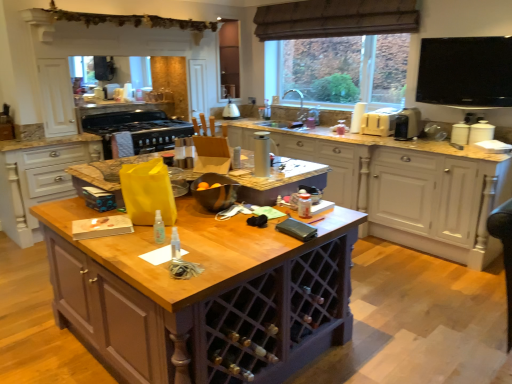
Locate an element on the screen. This screenshot has width=512, height=384. brown textured curtain at upper center is located at coordinates point(335,19).

This screenshot has width=512, height=384. In order to click on wooden island at center, the second cabinetry in the right-to-left sequence in this screenshot , I will do `click(204, 296)`.

Where is `metallic silver bowl at center, the seventh appliance from the back`? The height and width of the screenshot is (384, 512). metallic silver bowl at center, the seventh appliance from the back is located at coordinates (215, 191).

The width and height of the screenshot is (512, 384). I want to click on brown textured curtain at upper center, so click(x=335, y=19).

Considering the relative sizes of metallic silver bowl at center, the 3th appliance from the left, and metallic silver toaster at right in the image provided, is metallic silver bowl at center, the 3th appliance from the left, thinner than metallic silver toaster at right?

Yes.

Is metallic silver bowl at center, which is counted as the first appliance, starting from the front, smaller than metallic silver toaster at right?

Actually, metallic silver bowl at center, which is counted as the first appliance, starting from the front, might be larger than metallic silver toaster at right.

Is point (208, 175) less distant than point (408, 116)?

Yes, it is in front of point (408, 116).

In terms of height, does metallic silver bowl at center, which is counted as the first appliance, starting from the front, look taller or shorter compared to metallic silver toaster at right?

Clearly, metallic silver bowl at center, which is counted as the first appliance, starting from the front, is shorter compared to metallic silver toaster at right.

From the image's perspective, who appears lower, metallic silver bowl at center, the 3th appliance from the left, or transparent plastic spray bottle at center?

transparent plastic spray bottle at center appears lower in the image.

Is metallic silver bowl at center, which is counted as the first appliance, starting from the front, completely or partially outside of transparent plastic spray bottle at center?

Yes, metallic silver bowl at center, which is counted as the first appliance, starting from the front, is outside of transparent plastic spray bottle at center.

Considering the sizes of objects metallic silver bowl at center, which is the 5th appliance in right-to-left order, and transparent plastic spray bottle at center in the image provided, who is bigger, metallic silver bowl at center, which is the 5th appliance in right-to-left order, or transparent plastic spray bottle at center?

Bigger between the two is metallic silver bowl at center, which is the 5th appliance in right-to-left order.

Locate an element on the screen. the 2nd appliance to the right of the transparent plastic spray bottle at center, starting your count from the anchor is located at coordinates (215, 191).

Would you say white matte canister at right, the 3th appliance positioned from the front, is to the left or to the right of metallic silver kettle at center, which is the 6th appliance from right to left, in the picture?

white matte canister at right, the 3th appliance positioned from the front, is to the right of metallic silver kettle at center, which is the 6th appliance from right to left.

Is point (490, 137) more distant than point (225, 112)?

No, it is not.

Can you confirm if white matte canister at right, which is counted as the seventh appliance, starting from the left, is thinner than metallic silver kettle at center, which is the 6th appliance from right to left?

Yes.

From the image's perspective, which one is positioned lower, white matte canister at right, the 3th appliance positioned from the front, or metallic silver kettle at center, which is the 6th appliance from right to left?

From the image's view, white matte canister at right, the 3th appliance positioned from the front, is below.

Is point (213, 176) behind point (260, 143)?

No.

Is metallic silver bowl at center, the seventh appliance from the back, surrounding silver metallic thermos at center, arranged as the 2th appliance when viewed from the front?

No, silver metallic thermos at center, arranged as the 2th appliance when viewed from the front, is not surrounded by metallic silver bowl at center, the seventh appliance from the back.

From a real-world perspective, between metallic silver bowl at center, the 3th appliance from the left, and silver metallic thermos at center, arranged as the 2th appliance when viewed from the front, who is vertically higher?

silver metallic thermos at center, arranged as the 2th appliance when viewed from the front, is physically above.

From the picture: Is silver metallic thermos at center, which ranks as the fourth appliance in left-to-right order, at the back of metallic silver bowl at center, the seventh appliance from the back?

No, metallic silver bowl at center, the seventh appliance from the back, is not facing away from silver metallic thermos at center, which ranks as the fourth appliance in left-to-right order.

From the image's perspective, which appliance is the 1st one above the wooden cabinet at center, the third cabinetry from the right? Please provide its 2D coordinates.

[(262, 154)]

Is wooden cabinet at center, which ranks as the first cabinetry in left-to-right order, surrounding silver metallic thermos at center, the fourth appliance when ordered from right to left?

Definitely not — silver metallic thermos at center, the fourth appliance when ordered from right to left, is not inside wooden cabinet at center, which ranks as the first cabinetry in left-to-right order.

Who is shorter, wooden cabinet at center, the third cabinetry from the right, or silver metallic thermos at center, arranged as the 2th appliance when viewed from the front?

silver metallic thermos at center, arranged as the 2th appliance when viewed from the front, is shorter.

Considering their positions, is transparent plastic spray bottle at center located in front of or behind metallic silver toaster at right?

In the image, transparent plastic spray bottle at center appears in front of metallic silver toaster at right.

From a real-world perspective, is transparent plastic spray bottle at center over metallic silver toaster at right?

No, from a real-world perspective, transparent plastic spray bottle at center is not on top of metallic silver toaster at right.

Identify the location of bottle in front of the metallic silver toaster at right. (159, 228).

From the image's perspective, which is above, wooden island at center, the 2th cabinetry when ordered from left to right, or beige plastic toaster at upper right, the 3th appliance when ordered from back to front?

beige plastic toaster at upper right, the 3th appliance when ordered from back to front, appears higher in the image.

Is wooden island at center, the 2th cabinetry when ordered from left to right, wider than beige plastic toaster at upper right, the 3th appliance when ordered from back to front?

Yes, wooden island at center, the 2th cabinetry when ordered from left to right, is wider than beige plastic toaster at upper right, the 3th appliance when ordered from back to front.

Which appliance is the 4th one when counting from the right side of the wooden island at center, the 2th cabinetry when ordered from left to right? Please provide its 2D coordinates.

[(379, 122)]

Does wooden island at center, the 2th cabinetry when ordered from left to right, have a greater height compared to beige plastic toaster at upper right, which is counted as the third appliance, starting from the right?

Correct, wooden island at center, the 2th cabinetry when ordered from left to right, is much taller as beige plastic toaster at upper right, which is counted as the third appliance, starting from the right.

This screenshot has width=512, height=384. What are the coordinates of `the 3rd appliance to the left of the metallic silver toaster at right, starting your count from the anchor` in the screenshot? It's located at tap(215, 191).

Where is `bottle that is below the metallic silver bowl at center, which is the 5th appliance in right-to-left order (from the image's perspective)`? Image resolution: width=512 pixels, height=384 pixels. bottle that is below the metallic silver bowl at center, which is the 5th appliance in right-to-left order (from the image's perspective) is located at coordinates (159, 228).

Which object lies further to the anchor point white ceramic canister at right, acting as the sixth appliance starting from the left, transparent plastic spray bottle at center or silver metallic thermos at center, arranged as the 2th appliance when viewed from the front?

transparent plastic spray bottle at center is positioned further to the anchor white ceramic canister at right, acting as the sixth appliance starting from the left.

From the image, which object appears to be nearer to wooden cabinet at center, the third cabinetry from the right, wooden island at center, the second cabinetry in the right-to-left sequence, or brown textured curtain at upper center?

wooden island at center, the second cabinetry in the right-to-left sequence.

Looking at the image, which one is located closer to metallic silver bowl at center, which is counted as the first appliance, starting from the front, brown textured curtain at upper center or silver metallic thermos at center, arranged as the 2th appliance when viewed from the front?

silver metallic thermos at center, arranged as the 2th appliance when viewed from the front, lies closer to metallic silver bowl at center, which is counted as the first appliance, starting from the front, than the other object.

Based on their spatial positions, is wooden island at center, the 2th cabinetry when ordered from left to right, or white matte canister at right, which is the fifth appliance from back to front, closer to black matte stove at upper left, which is counted as the 7th appliance, starting from the right?

wooden island at center, the 2th cabinetry when ordered from left to right, lies closer to black matte stove at upper left, which is counted as the 7th appliance, starting from the right, than the other object.

Which object lies further to the anchor point white matte canister at right, the 3th appliance positioned from the front, silver metallic thermos at center, the 6th appliance from the back, or metallic silver toaster at right?

silver metallic thermos at center, the 6th appliance from the back, lies further to white matte canister at right, the 3th appliance positioned from the front, than the other object.

Which object lies further to the anchor point metallic silver kettle at center, which is the 6th appliance from right to left, beige plastic toaster at upper right, which is counted as the third appliance, starting from the right, or white matte canister at right, which ranks as the first appliance in right-to-left order?

white matte canister at right, which ranks as the first appliance in right-to-left order, is further to metallic silver kettle at center, which is the 6th appliance from right to left.

In the scene shown: From the image, which object appears to be nearer to wooden island at center, the second cabinetry in the right-to-left sequence, metallic silver bowl at center, which is the 5th appliance in right-to-left order, or brown textured curtain at upper center?

Based on the image, metallic silver bowl at center, which is the 5th appliance in right-to-left order, appears to be nearer to wooden island at center, the second cabinetry in the right-to-left sequence.

Looking at the image, which one is located further to white ceramic canister at right, acting as the sixth appliance starting from the left, black matte stove at upper left, the 6th appliance from the front, or white wood cabinets at center, the 3th cabinetry when ordered from left to right?

black matte stove at upper left, the 6th appliance from the front, is further to white ceramic canister at right, acting as the sixth appliance starting from the left.

Identify the location of kitchen appliance situated between black matte stove at upper left, the 6th appliance from the front, and white matte canister at right, which is the fifth appliance from back to front, from left to right. This screenshot has height=384, width=512. (407, 124).

Where is `curtain situated between black matte stove at upper left, positioned as the first appliance in left-to-right order, and metallic silver toaster at right from left to right`? The image size is (512, 384). curtain situated between black matte stove at upper left, positioned as the first appliance in left-to-right order, and metallic silver toaster at right from left to right is located at coordinates (335, 19).

What are the coordinates of `bottle between brown textured curtain at upper center and wooden island at center, the second cabinetry in the right-to-left sequence, in the vertical direction` in the screenshot? It's located at (159, 228).

Locate an element on the screen. kitchen appliance between white wood cabinets at center, the 1th cabinetry positioned from the right, and white ceramic canister at right, placed as the fourth appliance when sorted from front to back, in the horizontal direction is located at coordinates (407, 124).